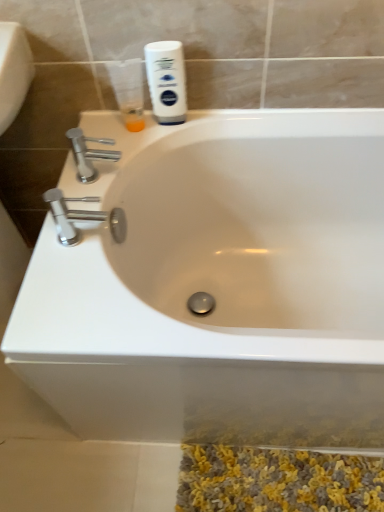
Find the location of `free space between translucent plastic cup at upper left and polished chrome faucet at upper left, the 2th tap viewed from the front`. free space between translucent plastic cup at upper left and polished chrome faucet at upper left, the 2th tap viewed from the front is located at coordinates (121, 147).